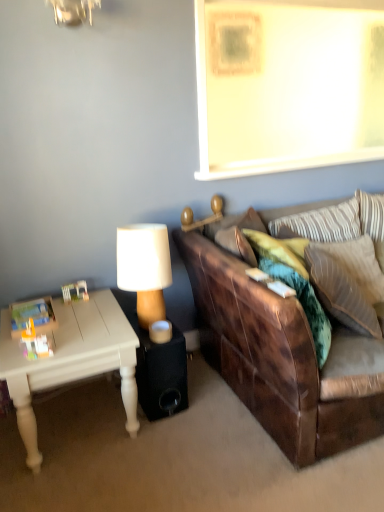
Question: From a real-world perspective, is wooden lampshade at center, which is the 2th lamp from top to bottom, physically located above or below striped fabric pillow at upper right, the 3th pillow in the front-to-back sequence?

Choices:
 (A) above
 (B) below

Answer: (B)

Question: Based on their positions, is wooden lampshade at center, which is the 2th lamp from top to bottom, located to the left or right of striped fabric pillow at upper right, the 3th pillow in the front-to-back sequence?

Choices:
 (A) left
 (B) right

Answer: (A)

Question: Considering the real-world distances, which object is farthest from the wooden lampshade at upper center, the first lamp when ordered from top to bottom?

Choices:
 (A) velvet green pillow at right, the second pillow from the back
 (B) striped fabric pillow at upper right, the 1th pillow positioned from the back
 (C) leather couch at right
 (D) wooden lampshade at center, the 2th lamp when ordered from right to left
 (E) white painted wood coffee table at lower left

Answer: (E)

Question: Estimate the real-world distances between objects in this image. Which object is farther from the wooden lampshade at center, the first lamp from the left?

Choices:
 (A) leather couch at right
 (B) wooden lampshade at upper center, the 2th lamp in the bottom-to-top sequence
 (C) striped fabric pillow at upper right, the 1th pillow positioned from the back
 (D) black fabric speaker at lower center
 (E) white painted wood coffee table at lower left

Answer: (C)